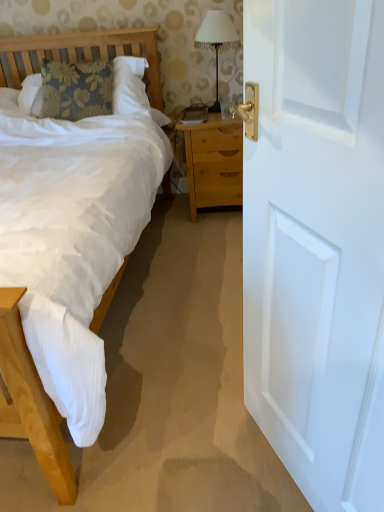
Question: Can you confirm if light brown wooden nightstand at center is shorter than white painted wood door at right?

Choices:
 (A) no
 (B) yes

Answer: (B)

Question: Is light brown wooden nightstand at center not within white painted wood door at right?

Choices:
 (A) yes
 (B) no

Answer: (A)

Question: Is light brown wooden nightstand at center oriented away from white painted wood door at right?

Choices:
 (A) yes
 (B) no

Answer: (B)

Question: From a real-world perspective, does light brown wooden nightstand at center stand above white painted wood door at right?

Choices:
 (A) yes
 (B) no

Answer: (B)

Question: Does light brown wooden nightstand at center have a greater height compared to white painted wood door at right?

Choices:
 (A) no
 (B) yes

Answer: (A)

Question: Is the position of light brown wooden nightstand at center less distant than that of white painted wood door at right?

Choices:
 (A) no
 (B) yes

Answer: (A)

Question: Can you confirm if white fabric lampshade at upper center is taller than light brown wooden nightstand at center?

Choices:
 (A) no
 (B) yes

Answer: (A)

Question: Considering the relative sizes of white fabric lampshade at upper center and light brown wooden nightstand at center in the image provided, is white fabric lampshade at upper center wider than light brown wooden nightstand at center?

Choices:
 (A) yes
 (B) no

Answer: (B)

Question: Would you say light brown wooden nightstand at center is part of white fabric lampshade at upper center's contents?

Choices:
 (A) yes
 (B) no

Answer: (B)

Question: Is white fabric lampshade at upper center far from light brown wooden nightstand at center?

Choices:
 (A) yes
 (B) no

Answer: (B)

Question: Would you say white fabric lampshade at upper center is outside light brown wooden nightstand at center?

Choices:
 (A) no
 (B) yes

Answer: (B)

Question: Does white fabric lampshade at upper center appear on the left side of light brown wooden nightstand at center?

Choices:
 (A) yes
 (B) no

Answer: (B)

Question: Can you confirm if white fabric lampshade at upper center is wider than white painted wood door at right?

Choices:
 (A) no
 (B) yes

Answer: (B)